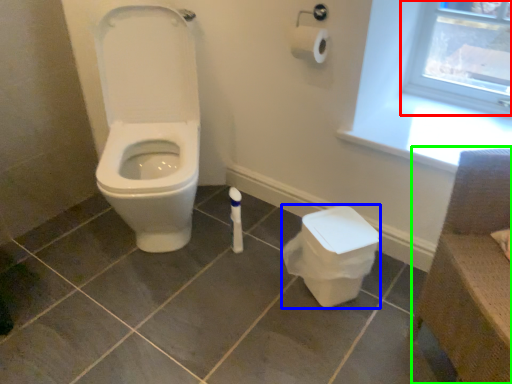
Question: Which object is positioned farthest from window frame (highlighted by a red box)? Select from potty (highlighted by a blue box) and chair (highlighted by a green box).

Choices:
 (A) potty
 (B) chair

Answer: (B)